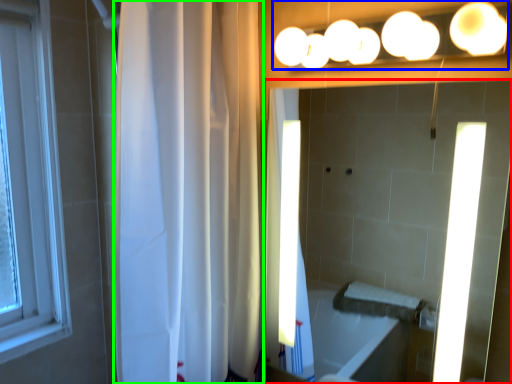
Question: Estimate the real-world distances between objects in this image. Which object is closer to mirror (highlighted by a red box), fixture (highlighted by a blue box) or shower curtain (highlighted by a green box)?

Choices:
 (A) fixture
 (B) shower curtain

Answer: (A)